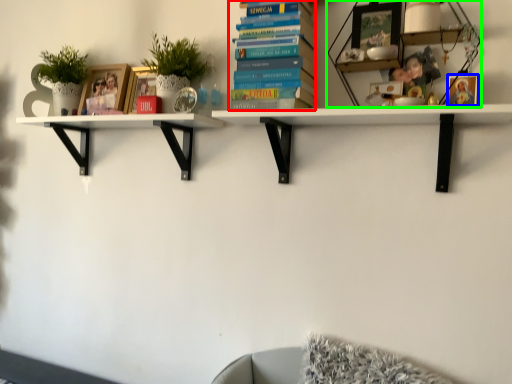
Question: Which object is positioned closest to book (highlighted by a red box)? Select from picture frame (highlighted by a blue box) and shelf (highlighted by a green box).

Choices:
 (A) picture frame
 (B) shelf

Answer: (B)